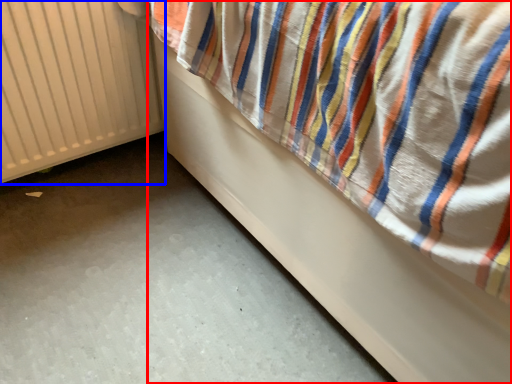
Question: Which object appears closest to the camera in this image, furniture (highlighted by a red box) or radiator (highlighted by a blue box)?

Choices:
 (A) furniture
 (B) radiator

Answer: (A)